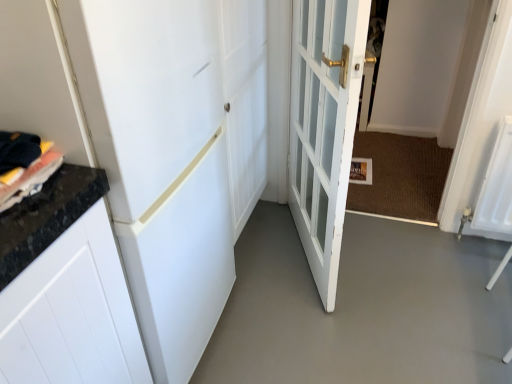
Question: Is white matte door at upper left, which is counted as the second door, starting from the right, shorter than white glass door at center, the second door positioned from the left?

Choices:
 (A) yes
 (B) no

Answer: (B)

Question: Is white matte door at upper left, positioned as the first door in left-to-right order, thinner than white glass door at center, which appears as the 1th door when viewed from the right?

Choices:
 (A) no
 (B) yes

Answer: (A)

Question: From the image's perspective, is white matte door at upper left, positioned as the first door in left-to-right order, located beneath white glass door at center, which appears as the 1th door when viewed from the right?

Choices:
 (A) yes
 (B) no

Answer: (A)

Question: Is white glass door at center, which appears as the 1th door when viewed from the right, completely or partially inside white matte door at upper left, positioned as the first door in left-to-right order?

Choices:
 (A) yes
 (B) no

Answer: (B)

Question: Is white matte door at upper left, which is counted as the second door, starting from the right, taller than white glass door at center, which appears as the 1th door when viewed from the right?

Choices:
 (A) yes
 (B) no

Answer: (A)

Question: From the image's perspective, is white matte door at upper left, which is counted as the second door, starting from the right, on top of white glass door at center, the second door positioned from the left?

Choices:
 (A) yes
 (B) no

Answer: (B)

Question: From a real-world perspective, is gray smooth concrete at center physically below white glass door at center, the second door positioned from the left?

Choices:
 (A) yes
 (B) no

Answer: (A)

Question: Considering the relative sizes of gray smooth concrete at center and white glass door at center, which appears as the 1th door when viewed from the right, in the image provided, is gray smooth concrete at center smaller than white glass door at center, which appears as the 1th door when viewed from the right,?

Choices:
 (A) no
 (B) yes

Answer: (B)

Question: From a real-world perspective, is gray smooth concrete at center over white glass door at center, the second door positioned from the left?

Choices:
 (A) no
 (B) yes

Answer: (A)

Question: Could you tell me if gray smooth concrete at center is facing white glass door at center, which appears as the 1th door when viewed from the right?

Choices:
 (A) no
 (B) yes

Answer: (A)

Question: Does gray smooth concrete at center lie behind white glass door at center, which appears as the 1th door when viewed from the right?

Choices:
 (A) yes
 (B) no

Answer: (A)

Question: Is gray smooth concrete at center positioned in front of white glass door at center, which appears as the 1th door when viewed from the right?

Choices:
 (A) no
 (B) yes

Answer: (A)

Question: Would you say white glass door at center, which appears as the 1th door when viewed from the right, contains gray smooth concrete at center?

Choices:
 (A) yes
 (B) no

Answer: (B)